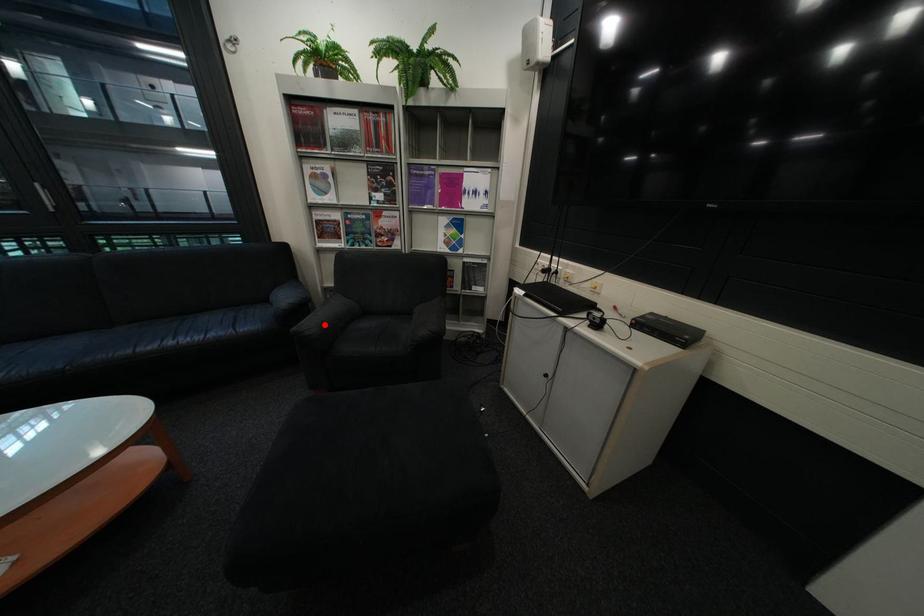
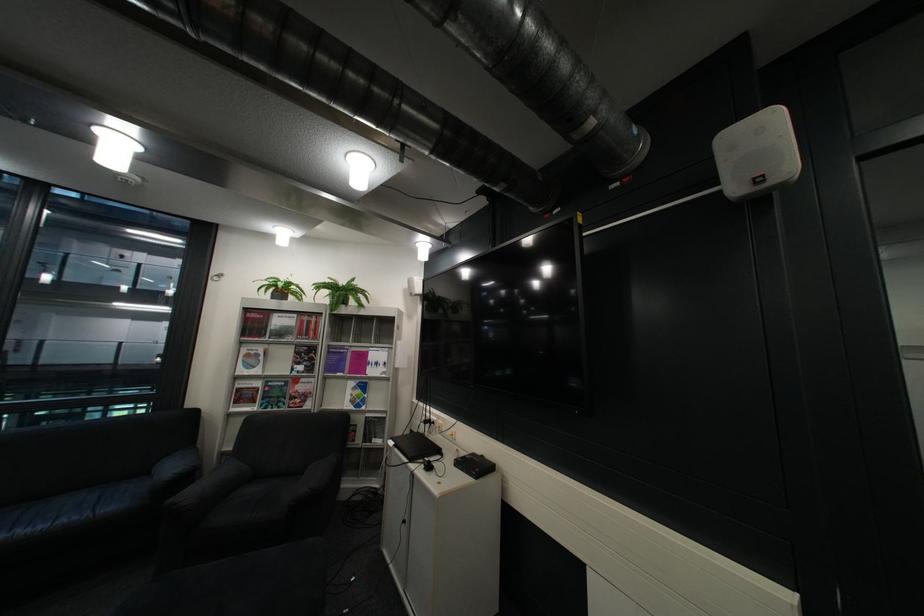
In the second image, find the point that corresponds to the highlighted location in the first image.

(204, 495)